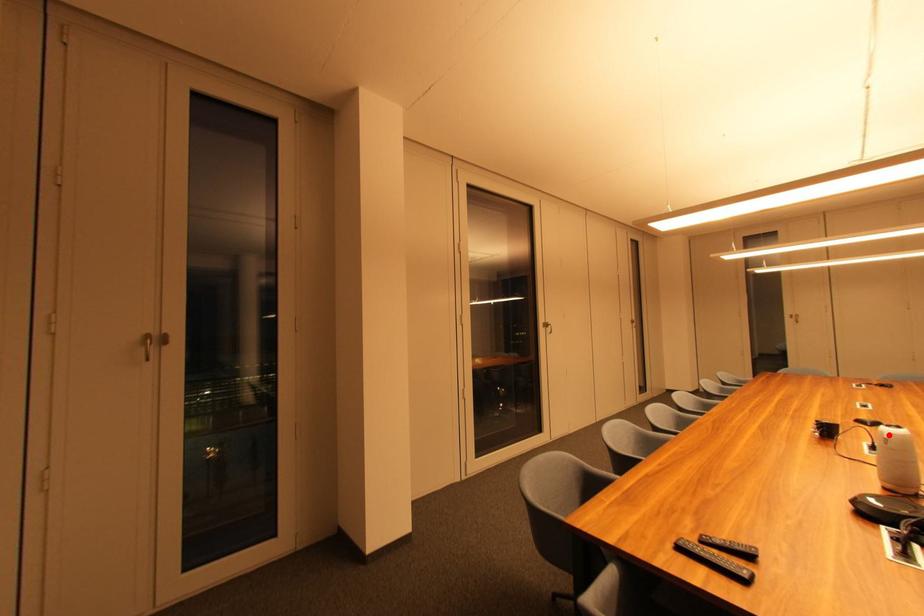
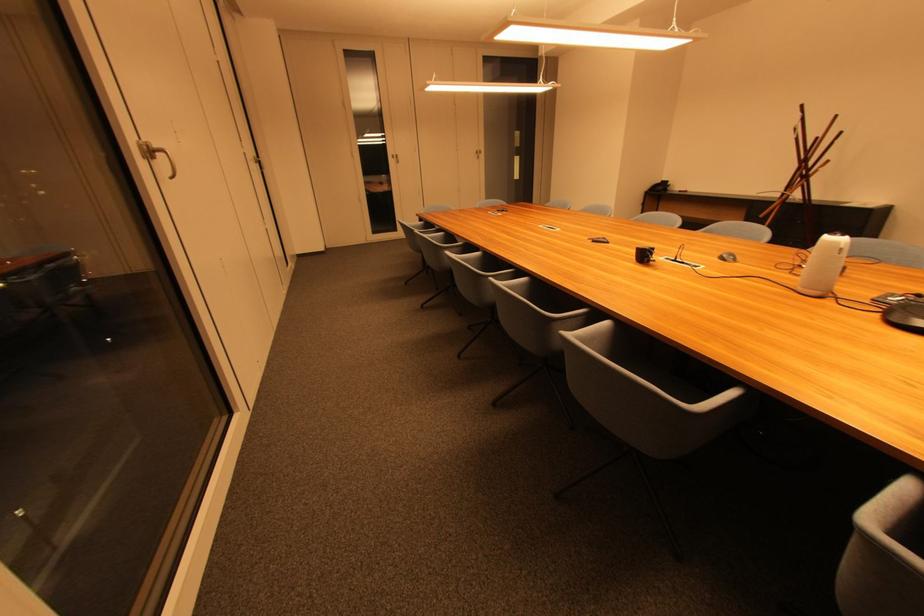
Question: A red point is marked in image1. In image2, is the corresponding 3D point closer to the camera or farther? Reply with the corresponding letter.

Choices:
 (A) The corresponding 3D point is closer.
 (B) The corresponding 3D point is farther.

Answer: (A)